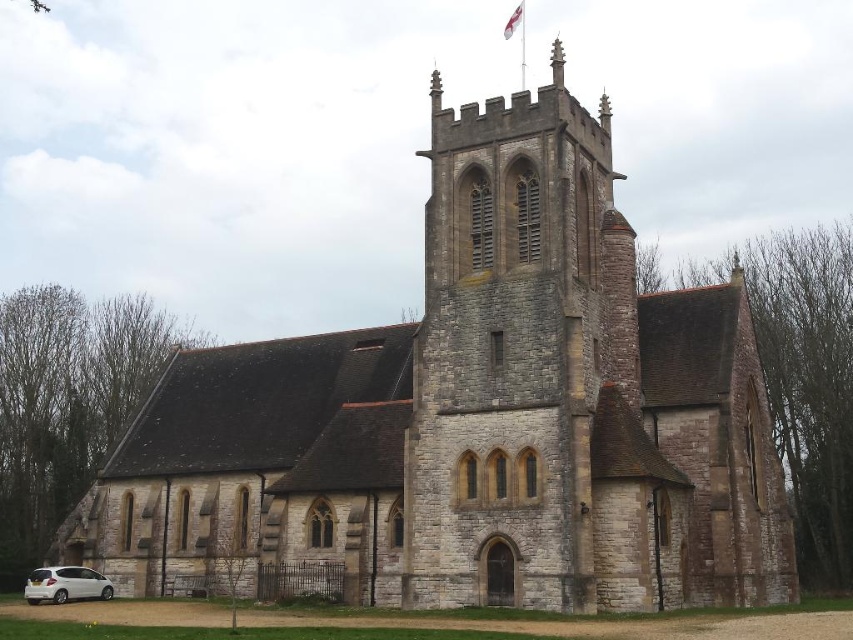
Which is behind, point (55, 600) or point (514, 29)?

The point (514, 29) is behind.

Does white matte hatchback at lower left appear on the right side of white fabric flag at upper center?

Incorrect, white matte hatchback at lower left is not on the right side of white fabric flag at upper center.

What do you see at coordinates (65, 584) in the screenshot? The width and height of the screenshot is (853, 640). I see `white matte hatchback at lower left` at bounding box center [65, 584].

This screenshot has width=853, height=640. Identify the location of white matte hatchback at lower left. (65, 584).